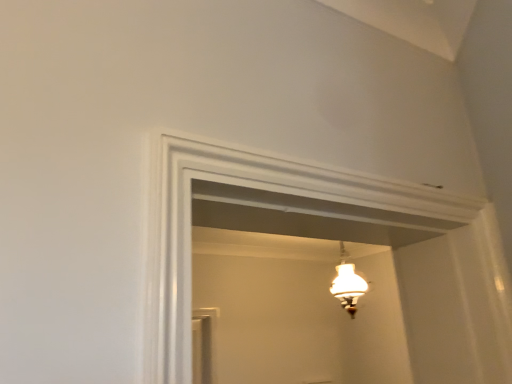
What do you see at coordinates (347, 284) in the screenshot? I see `white frosted glass chandelier at center` at bounding box center [347, 284].

Where is `white frosted glass chandelier at center`? The width and height of the screenshot is (512, 384). white frosted glass chandelier at center is located at coordinates (347, 284).

Where is `white frosted glass chandelier at center`? white frosted glass chandelier at center is located at coordinates point(347,284).